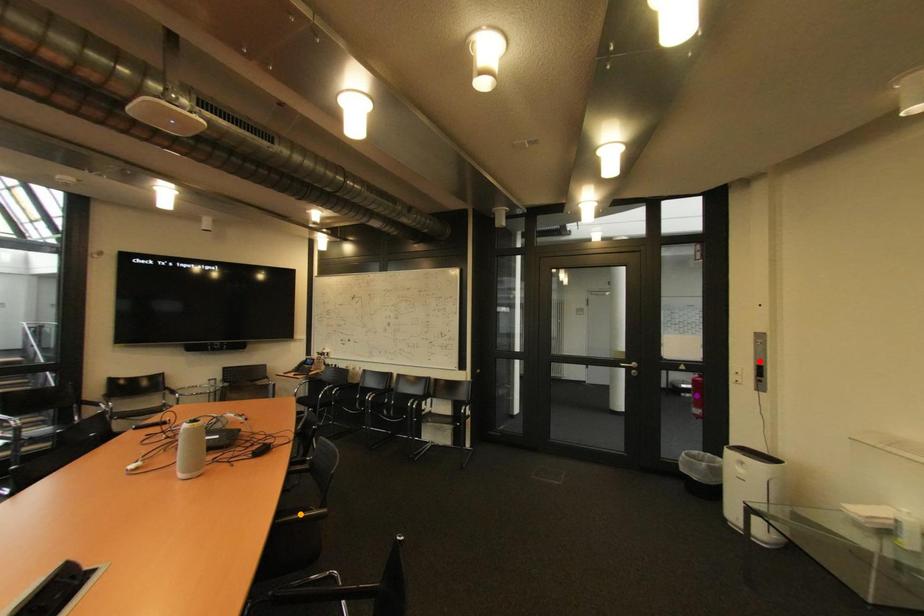
Order these from nearest to farthest:
orange point | red point | purple point

orange point, red point, purple point